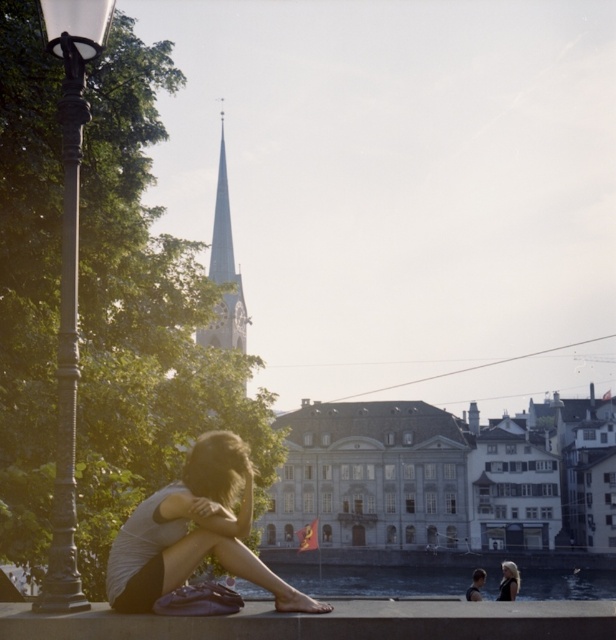
Question: Does smooth concrete ledge at lower center have a greater width compared to matte gray shirt at center?

Choices:
 (A) yes
 (B) no

Answer: (A)

Question: Is smooth white spire at center to the right of dark blonde hair at lower right from the viewer's perspective?

Choices:
 (A) yes
 (B) no

Answer: (B)

Question: Which is farther from the smooth concrete ledge at lower center?

Choices:
 (A) clear water at lower center
 (B) dark blonde hair at lower right

Answer: (B)

Question: Does clear water at lower center have a smaller size compared to dark blonde hair at lower right?

Choices:
 (A) no
 (B) yes

Answer: (A)

Question: Considering the real-world distances, which object is closest to the dark blonde hair at lower right?

Choices:
 (A) polished metal lamp post at left
 (B) clear water at lower center
 (C) matte gray shirt at center

Answer: (B)

Question: Estimate the real-world distances between objects in this image. Which object is closer to the matte gray shirt at center?

Choices:
 (A) smooth white spire at center
 (B) smooth blonde hair at lower right
 (C) clear water at lower center
 (D) smooth concrete ledge at lower center

Answer: (D)